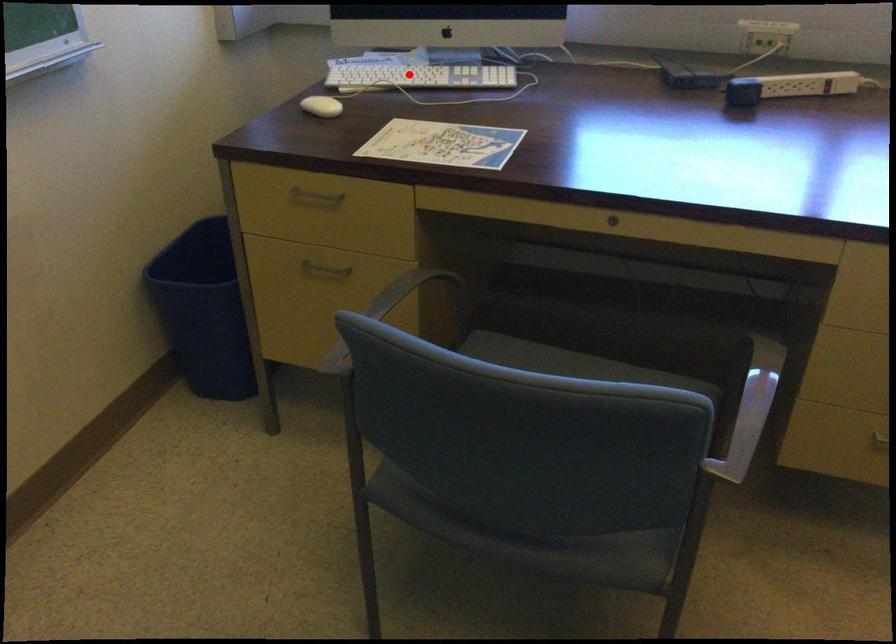
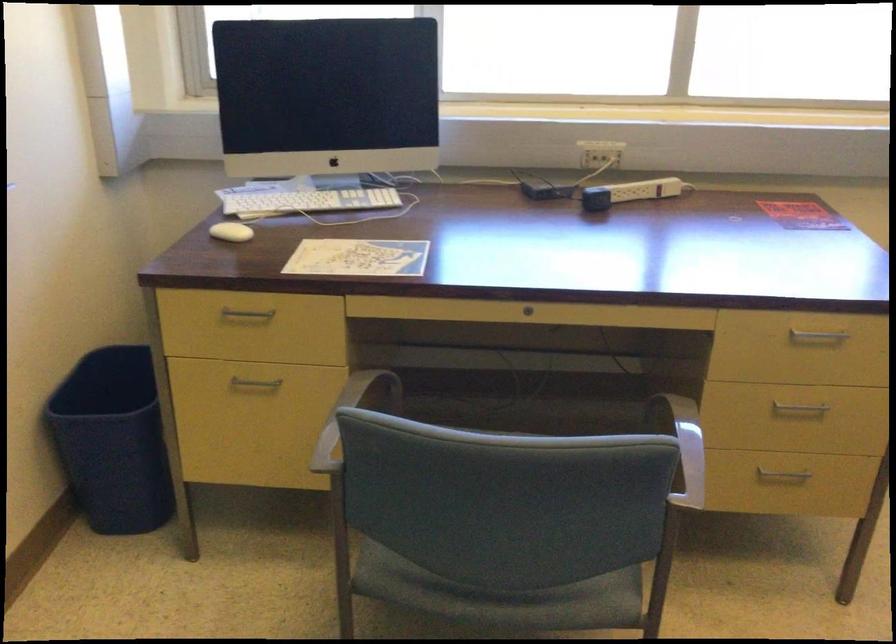
In the second image, find the point that corresponds to the highlighted location in the first image.

(304, 200)